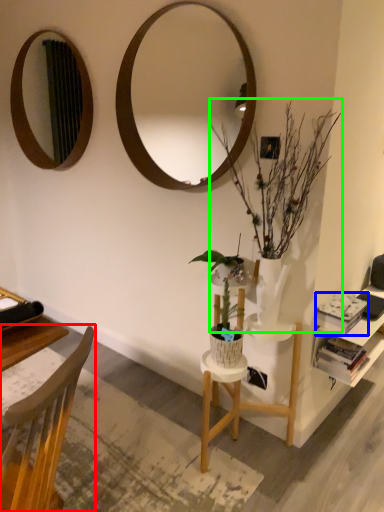
Question: Which object is the closest to the chair (highlighted by a red box)? Choose among these: book (highlighted by a blue box) or houseplant (highlighted by a green box).

Choices:
 (A) book
 (B) houseplant

Answer: (B)